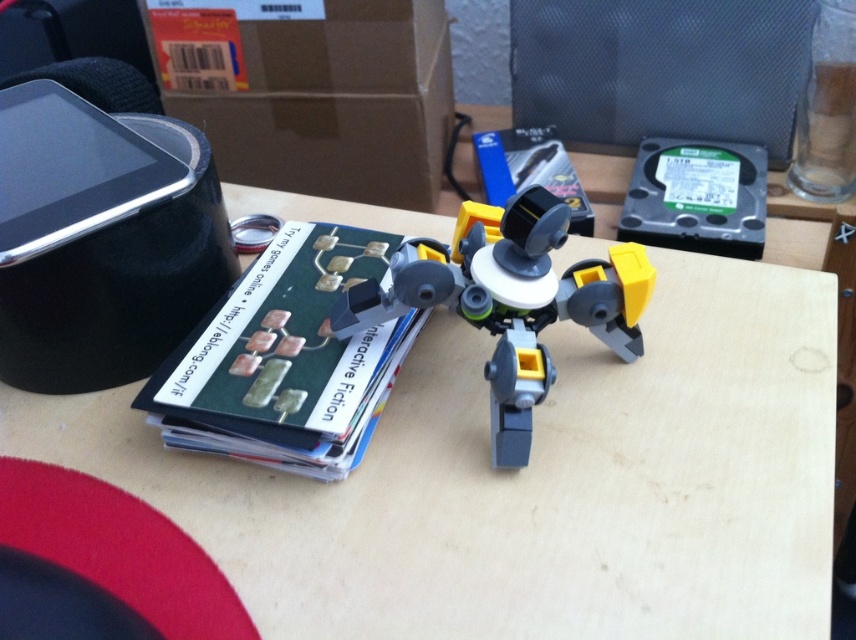
Question: Where is matte plastic book at center located in relation to gray plastic robot at center in the image?

Choices:
 (A) below
 (B) above

Answer: (B)

Question: Among these points, which one is nearest to the camera?

Choices:
 (A) (507, 426)
 (B) (195, 376)

Answer: (A)

Question: Where is matte plastic book at center located in relation to gray plastic robot at center in the image?

Choices:
 (A) below
 (B) above

Answer: (B)

Question: Which object is farther from the camera taking this photo?

Choices:
 (A) gray plastic robot at center
 (B) matte plastic book at center

Answer: (B)

Question: Which object is closer to the camera taking this photo?

Choices:
 (A) gray plastic robot at center
 (B) matte plastic book at center

Answer: (A)

Question: Is matte plastic book at center closer to the viewer compared to gray plastic robot at center?

Choices:
 (A) no
 (B) yes

Answer: (A)